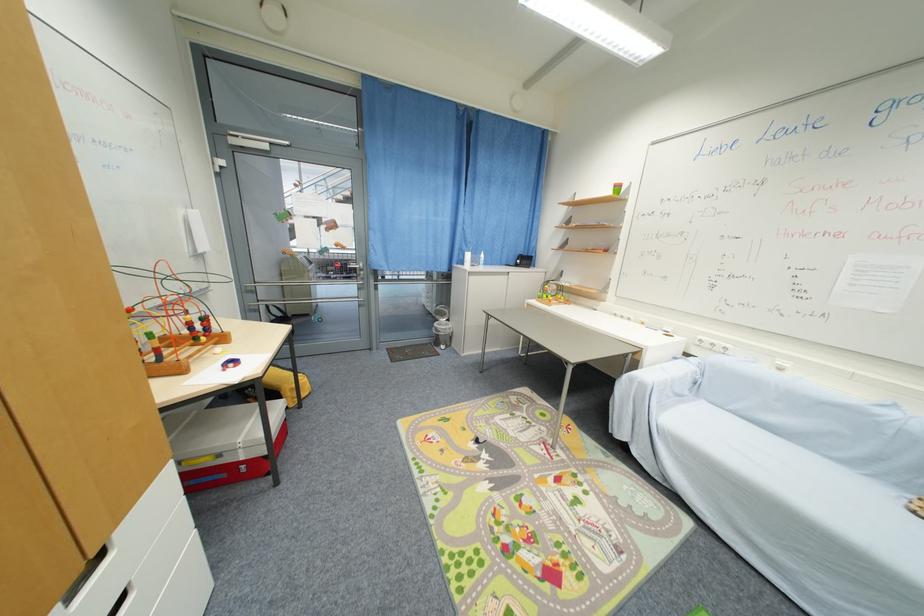
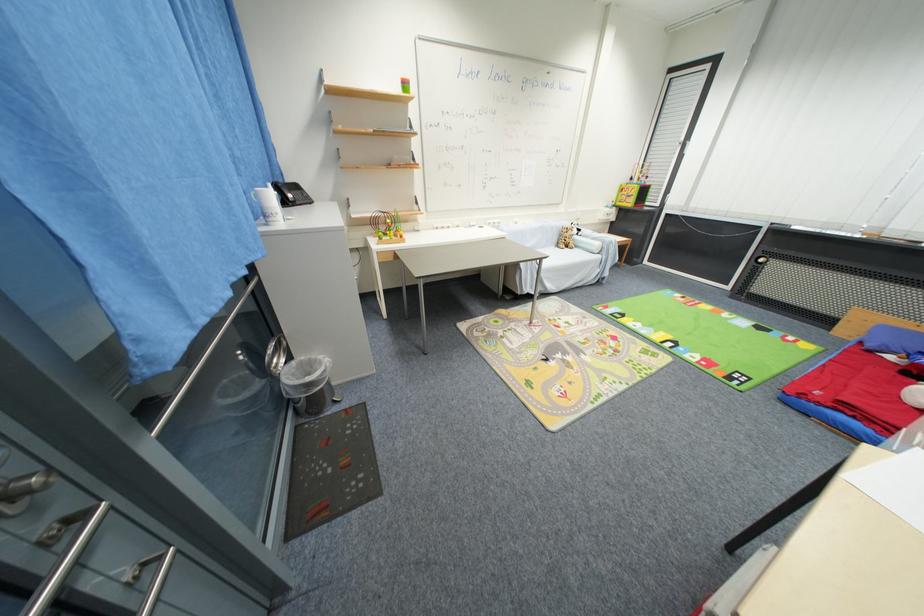
Where in the second image is the point corresponding to point (524, 262) from the first image?

(296, 198)